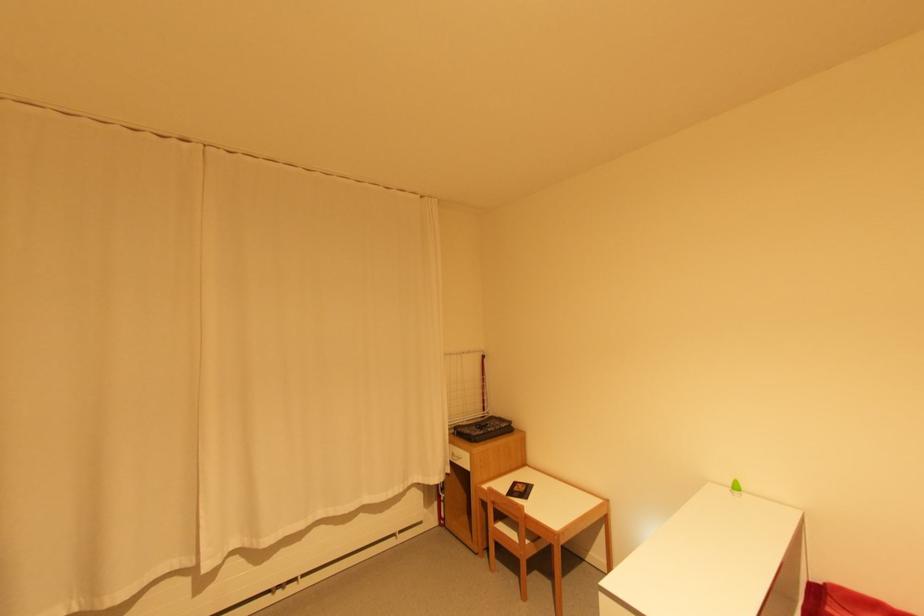
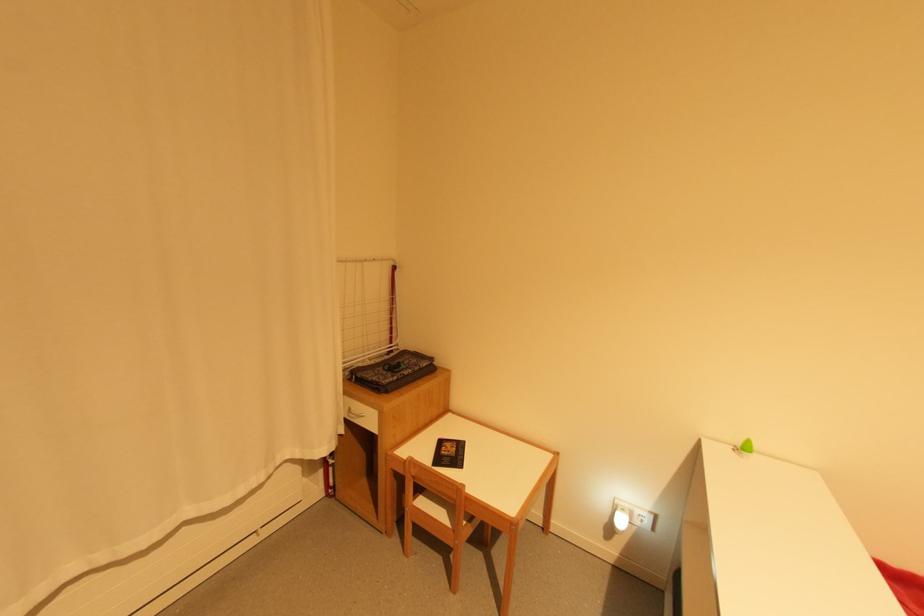
Question: In a continuous first-person perspective shot, in which direction is the camera moving?

Choices:
 (A) Left
 (B) Right
 (C) Forward
 (D) Backward

Answer: (C)